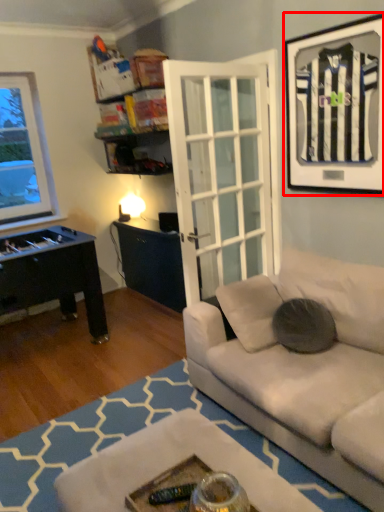
Question: Where is picture frame (annotated by the red box) located in relation to pillow in the image?

Choices:
 (A) left
 (B) right

Answer: (B)